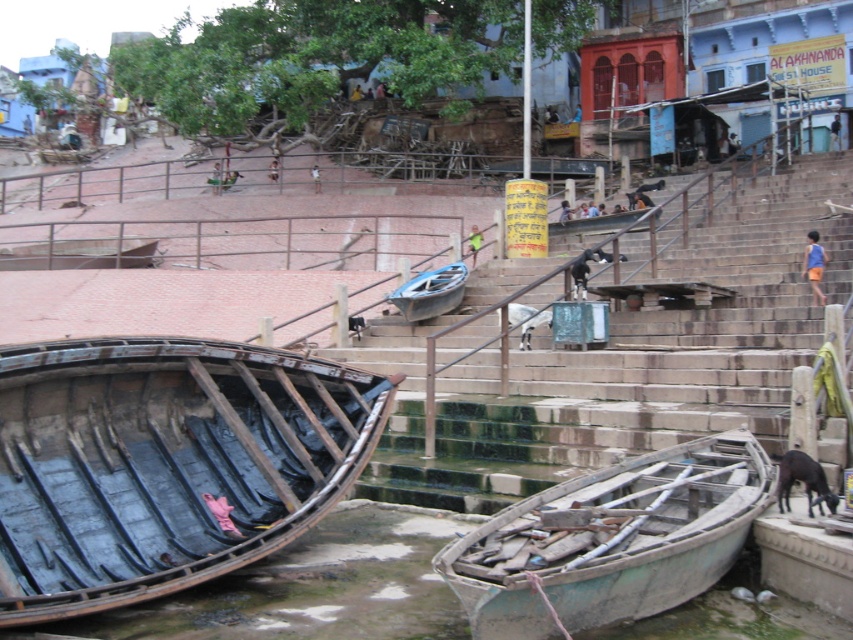
Question: Estimate the real-world distances between objects in this image. Which object is closer to the smooth stone stairs at center?

Choices:
 (A) green weathered boat at lower right
 (B) blue wooden boat at center
 (C) rusty wood boat at lower left

Answer: (B)

Question: From the image, what is the correct spatial relationship of green weathered boat at lower right in relation to blue wooden boat at center?

Choices:
 (A) right
 (B) left

Answer: (A)

Question: Is smooth stone stairs at center behind blue wooden boat at center?

Choices:
 (A) no
 (B) yes

Answer: (A)

Question: Which point is farther to the camera?

Choices:
 (A) (289, 534)
 (B) (410, 412)

Answer: (B)

Question: Which of the following is the closest to the observer?

Choices:
 (A) green weathered boat at lower right
 (B) smooth stone stairs at center
 (C) rusty wood boat at lower left

Answer: (A)

Question: Can you confirm if green weathered boat at lower right is positioned below blue wooden boat at center?

Choices:
 (A) no
 (B) yes

Answer: (B)